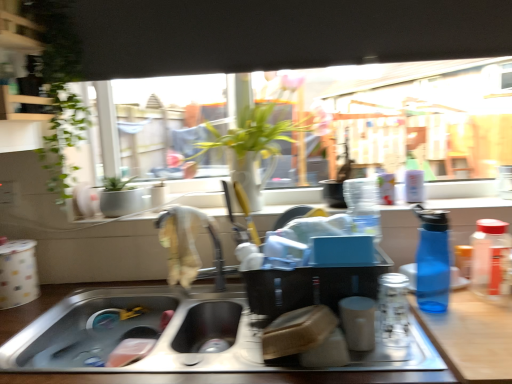
The image size is (512, 384). Identify the location of vacant space situated above wooden counter at lower right (from a real-world perspective). (473, 310).